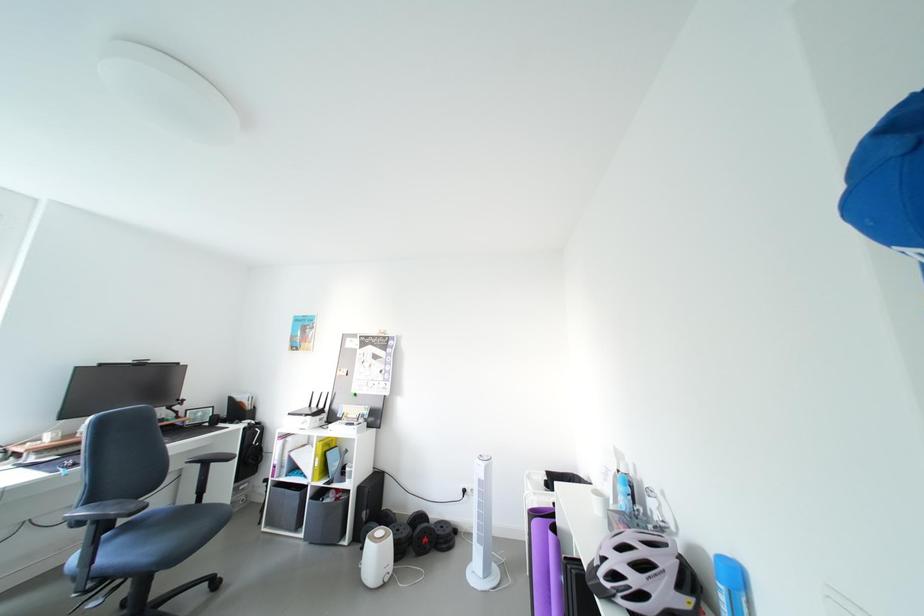
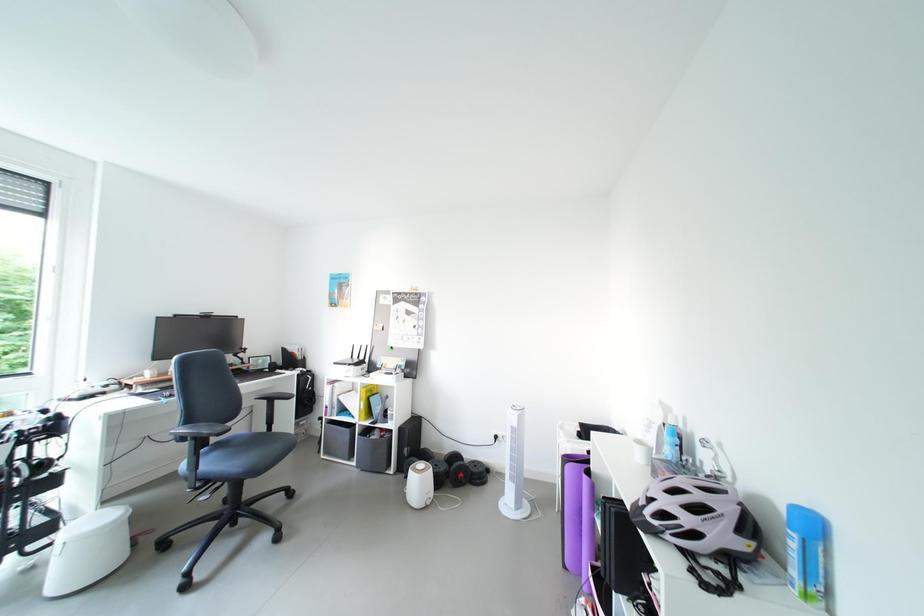
What movement of the cameraman would produce the second image?

The movement direction of the cameraman is left, forward.